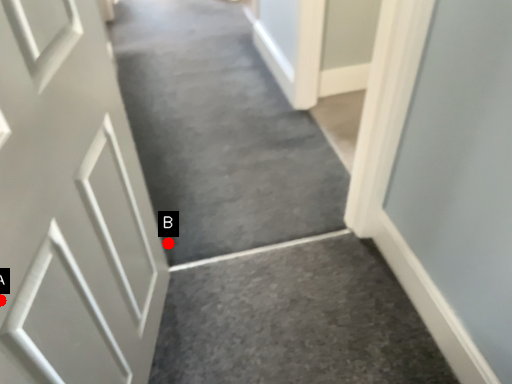
Question: Two points are circled on the image, labeled by A and B beside each circle. Which point is further to the camera?

Choices:
 (A) A is further
 (B) B is further

Answer: (B)